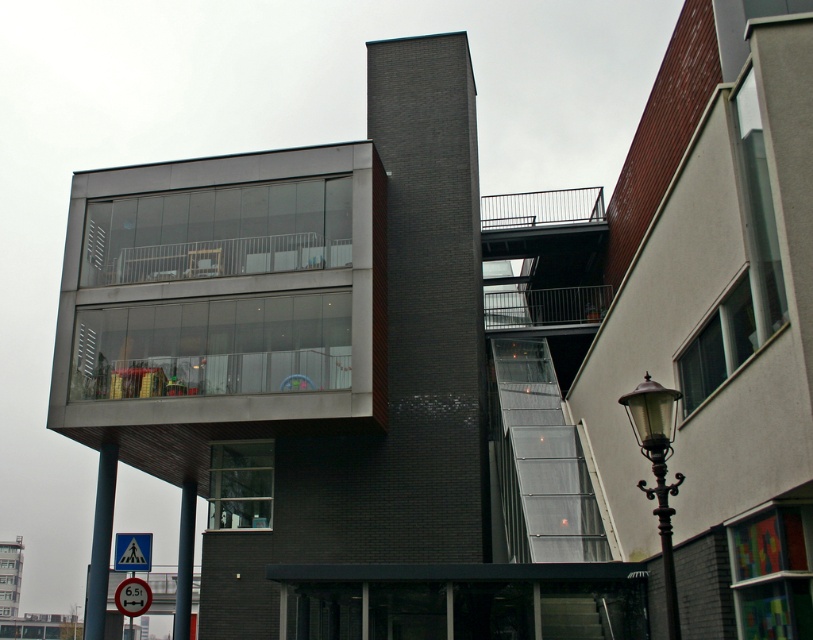
You are planning to install a new railing on the metallic gray balcony at upper center and the red plastic speed limit sign at lower left. Which object requires a wider railing based on their widths?

The metallic gray balcony at upper center requires a wider railing because its width is larger than the red plastic speed limit sign at lower left.

You are a delivery person trying to determine the best path to avoid hitting the metallic gray balcony at upper center and the red plastic speed limit sign at lower left. Since you need to pass between them, which object should you avoid hitting by moving away from the one that is larger?

The metallic gray balcony at upper center is bigger than the red plastic speed limit sign at lower left, so you should move away from the metallic gray balcony at upper center to avoid hitting it.

You are a delivery person approaching the building and need to park your van between the black wrought iron streetlight at lower right and the red plastic speed limit sign at lower left. Can you fit your van there if it requires a space of at least 3 meters in length?

The black wrought iron streetlight at lower right is much taller than the red plastic speed limit sign at lower left, but the question is about the space between them. Since the description does not provide information about the distance between the two objects, it is impossible to determine if the van can fit there.